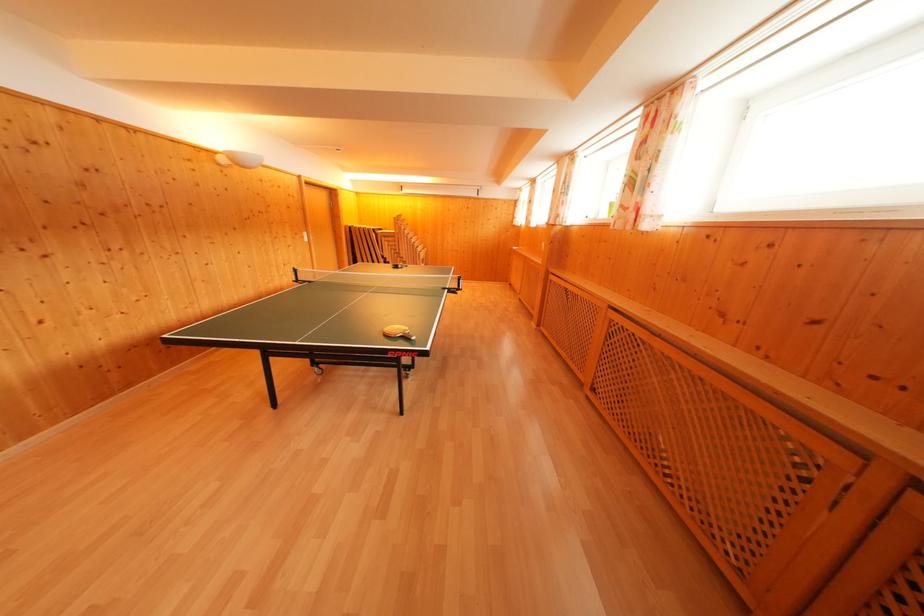
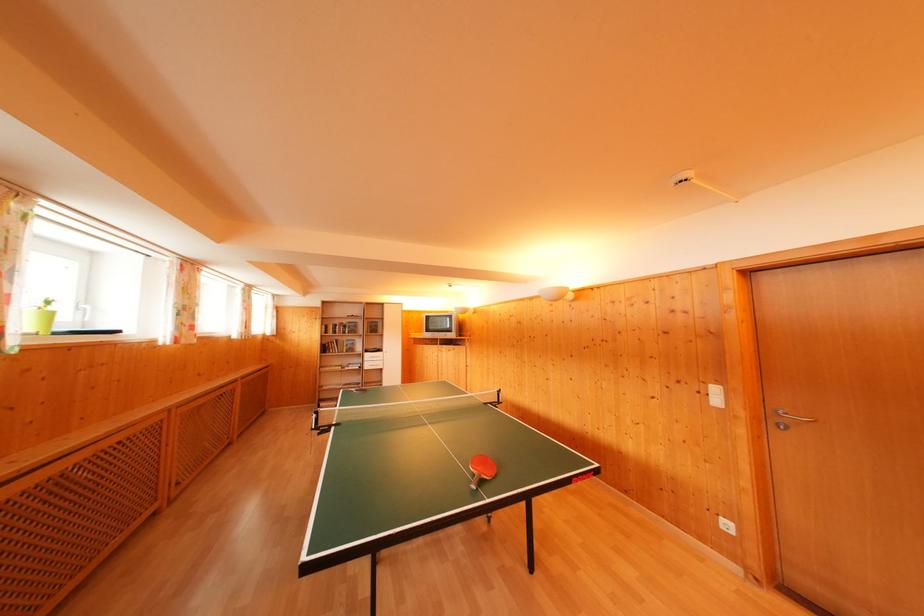
In the second image, find the point that corresponds to (x=310, y=240) in the first image.

(721, 395)